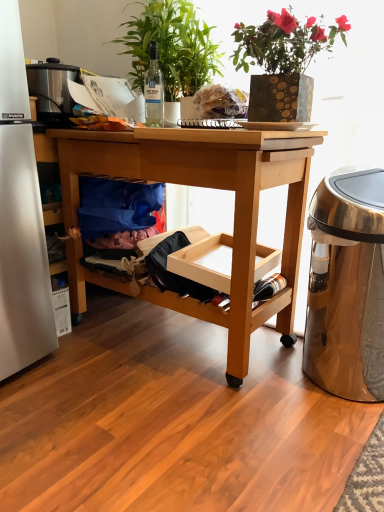
Question: From the image's perspective, would you say translucent glass bottle at lower right, which ranks as the 2th bottle in left-to-right order, is positioned over blue fabric bag at lower left?

Choices:
 (A) no
 (B) yes

Answer: (A)

Question: Can you confirm if translucent glass bottle at lower right, the first bottle when ordered from bottom to top, is positioned to the left of blue fabric bag at lower left?

Choices:
 (A) yes
 (B) no

Answer: (B)

Question: Considering the relative sizes of translucent glass bottle at lower right, the first bottle when ordered from bottom to top, and blue fabric bag at lower left in the image provided, is translucent glass bottle at lower right, the first bottle when ordered from bottom to top, bigger than blue fabric bag at lower left?

Choices:
 (A) yes
 (B) no

Answer: (B)

Question: Is translucent glass bottle at lower right, the first bottle when ordered from bottom to top, wider than blue fabric bag at lower left?

Choices:
 (A) no
 (B) yes

Answer: (A)

Question: Is translucent glass bottle at lower right, which ranks as the 2th bottle in left-to-right order, positioned before blue fabric bag at lower left?

Choices:
 (A) no
 (B) yes

Answer: (B)

Question: In terms of width, does gold-patterned pot at upper center, the 1th houseplant from the right, look wider or thinner when compared to translucent glass bottle at lower right, the first bottle when ordered from bottom to top?

Choices:
 (A) thin
 (B) wide

Answer: (B)

Question: Is gold-patterned pot at upper center, the second houseplant in the left-to-right sequence, to the left or to the right of translucent glass bottle at lower right, the first bottle when ordered from bottom to top, in the image?

Choices:
 (A) left
 (B) right

Answer: (B)

Question: In terms of size, does gold-patterned pot at upper center, the 1th houseplant from the right, appear bigger or smaller than translucent glass bottle at lower right, which is the second bottle from top to bottom?

Choices:
 (A) big
 (B) small

Answer: (A)

Question: In the image, is gold-patterned pot at upper center, the second houseplant in the left-to-right sequence, positioned in front of or behind translucent glass bottle at lower right, which ranks as the 2th bottle in left-to-right order?

Choices:
 (A) front
 (B) behind

Answer: (A)

Question: Is clear glass bottle at center, the second bottle when ordered from right to left, spatially inside gold-patterned pot at upper center, the 1th houseplant from the right, or outside of it?

Choices:
 (A) inside
 (B) outside

Answer: (B)

Question: From their relative heights in the image, would you say clear glass bottle at center, the second bottle when ordered from right to left, is taller or shorter than gold-patterned pot at upper center, the second houseplant in the left-to-right sequence?

Choices:
 (A) tall
 (B) short

Answer: (B)

Question: Looking at the image, does clear glass bottle at center, which is the first bottle from left to right, seem bigger or smaller compared to gold-patterned pot at upper center, the second houseplant in the left-to-right sequence?

Choices:
 (A) small
 (B) big

Answer: (A)

Question: Considering the positions of clear glass bottle at center, which is the first bottle from left to right, and gold-patterned pot at upper center, the 1th houseplant from the right, in the image, is clear glass bottle at center, which is the first bottle from left to right, wider or thinner than gold-patterned pot at upper center, the 1th houseplant from the right,?

Choices:
 (A) thin
 (B) wide

Answer: (A)

Question: Do you think blue fabric bag at lower left is within gold-patterned pot at upper center, the 1th houseplant from the right, or outside of it?

Choices:
 (A) inside
 (B) outside

Answer: (B)

Question: Is point (94, 181) closer or farther from the camera than point (251, 110)?

Choices:
 (A) closer
 (B) farther

Answer: (B)